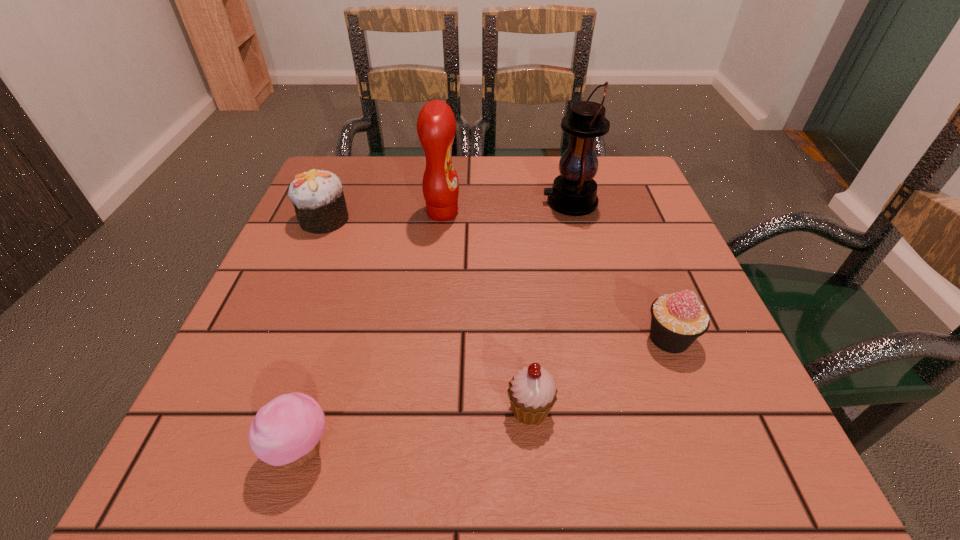
Where is `free spot that satisfies the following two spatial constraints: 1. on the label side of the third object from left to right; 2. on the left side of the second cupcake from right to left`? This screenshot has height=540, width=960. free spot that satisfies the following two spatial constraints: 1. on the label side of the third object from left to right; 2. on the left side of the second cupcake from right to left is located at coordinates (422, 409).

The width and height of the screenshot is (960, 540). Find the location of `blank area in the image that satisfies the following two spatial constraints: 1. above the fourth farthest object, indicating its light source; 2. on the right side of the fifth object from left to right`. blank area in the image that satisfies the following two spatial constraints: 1. above the fourth farthest object, indicating its light source; 2. on the right side of the fifth object from left to right is located at coordinates (605, 338).

Image resolution: width=960 pixels, height=540 pixels. Find the location of `vacant region that satisfies the following two spatial constraints: 1. on the front side of the third cupcake from left to right; 2. on the right side of the farthest cupcake`. vacant region that satisfies the following two spatial constraints: 1. on the front side of the third cupcake from left to right; 2. on the right side of the farthest cupcake is located at coordinates (245, 409).

Locate an element on the screen. Image resolution: width=960 pixels, height=540 pixels. vacant point that satisfies the following two spatial constraints: 1. above the lantern, indicating its light source; 2. on the right side of the third nearest object is located at coordinates (605, 338).